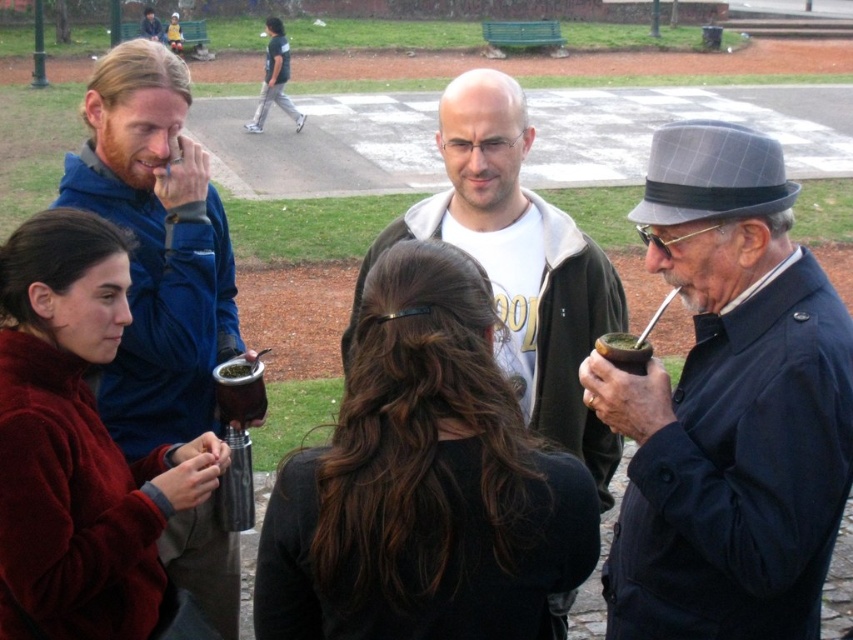
You are a photographer trying to capture a closeup shot of the matte black mate cup at lower center and the dark gray pants at upper center. Since you want to focus on the details of the mate cup, which object should you zoom in on more?

The matte black mate cup at lower center is smaller in size compared to the dark gray pants at upper center, so you should zoom in more on the matte black mate cup at lower center to capture its details clearly.

You are a photographer trying to capture a candid shot of the person with dark brown hair at center. Your camera is currently 8.08 feet away from them. According to the scene description, is this distance sufficient to ensure the subject fills the frame appropriately?

The dark brown hair at center and camera are 8.08 feet apart. This distance may be sufficient depending on the camera lens used, but typically for a candid portrait, a distance of around 8 feet can work with a standard lens to capture the subject filling the frame appropriately.

You are a photographer standing at the camera position and want to take a closeup photo of the matte black mate cup at lower center. The camera can focus on objects within 3 meters. Will you need to move closer to take the photo?

The matte black mate cup at lower center is 4.14 meters away from the camera, which is beyond the camera focus range of 3 meters. Therefore, you need to move closer to take the photo.